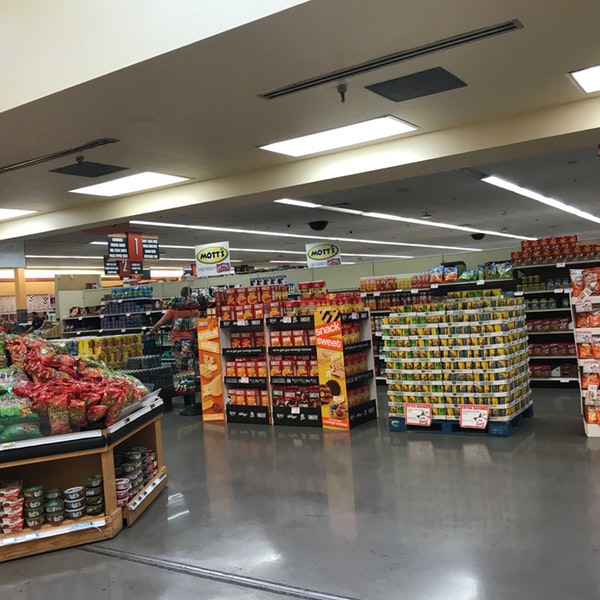
Locate an element on the screen. This screenshot has width=600, height=600. ceiling is located at coordinates (x=208, y=73).